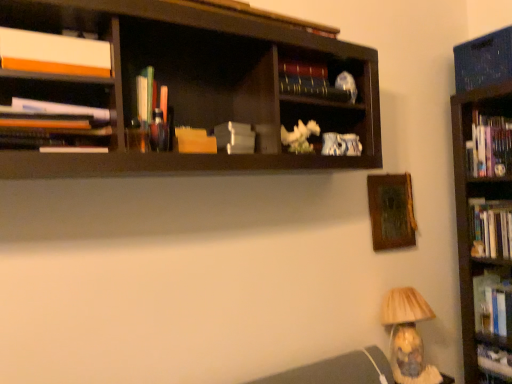
Question: Is hardcover book at right, which ranks as the third book in bottom-to-top order, in front of or behind hardcover book at upper center, the 10th book in the bottom-to-top sequence, in the image?

Choices:
 (A) front
 (B) behind

Answer: (B)

Question: From the image's perspective, is hardcover book at right, which ranks as the third book in bottom-to-top order, above or below hardcover book at upper center, the 10th book in the bottom-to-top sequence?

Choices:
 (A) below
 (B) above

Answer: (A)

Question: Which of these objects is positioned farthest from the hardcover book at right, the 9th book when ordered from top to bottom?

Choices:
 (A) matte white papers at left, which is the 6th book from bottom to top
 (B) white matte paper at center
 (C) hardcover books at right, the eighth book from the top
 (D) hardcover book at upper center, which is the 11th book in bottom-to-top order
 (E) hardcover book at upper center, the 10th book in the bottom-to-top sequence

Answer: (A)

Question: Based on their relative distances, which object is farther from the white matte paper at center?

Choices:
 (A) yellow paper at center, the seventh book in the top-to-bottom sequence
 (B) matte white papers at left, which is the 6th book from bottom to top
 (C) hardcover books at right, placed as the 4th book when sorted from bottom to top
 (D) hardcover book at lower right, which is the second book from bottom to top
 (E) hardcover book at upper center, which is the 11th book in bottom-to-top order

Answer: (D)